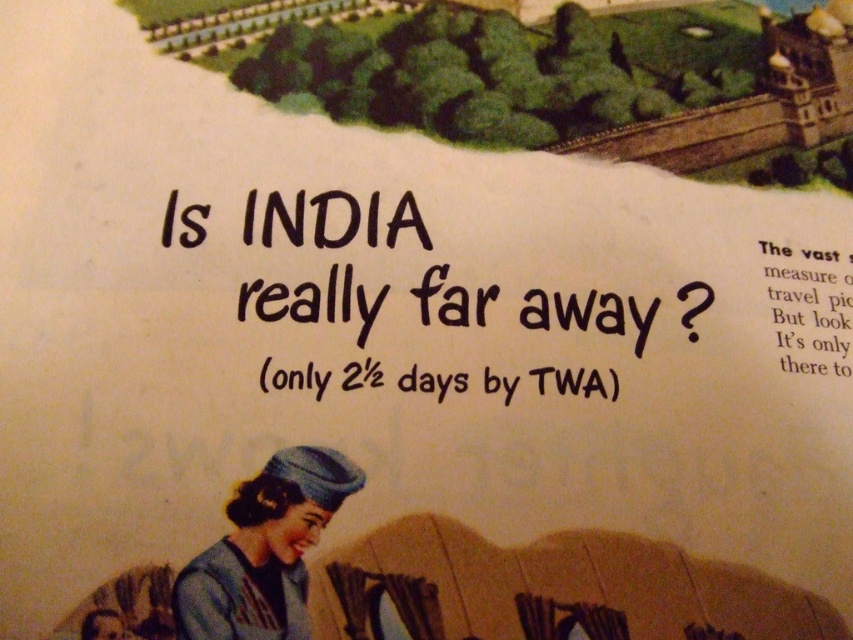
You are standing in front of the vintage TWA advertisement for India. There are two points marked on the image. The first point is at coordinate point [202,605] and the second point is at coordinate point [758,243]. Which point appears closer to you?

Point [202,605] is closer to the camera than point [758,243], so the first point is closer to you.

Based on the scene described, which object is positioned lower between the black ink text at center and the black paper text at upper right?

The black ink text at center is positioned lower than the black paper text at upper right.